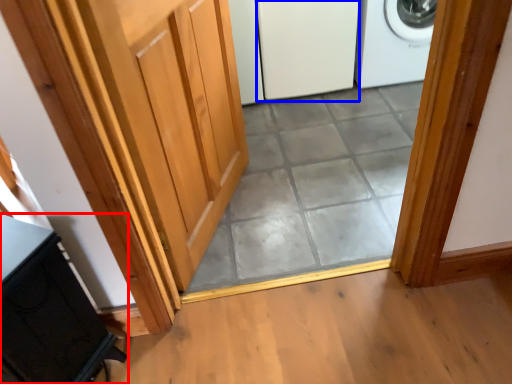
Question: Which object appears farthest to the camera in this image, cabinetry (highlighted by a red box) or screen door (highlighted by a blue box)?

Choices:
 (A) cabinetry
 (B) screen door

Answer: (B)